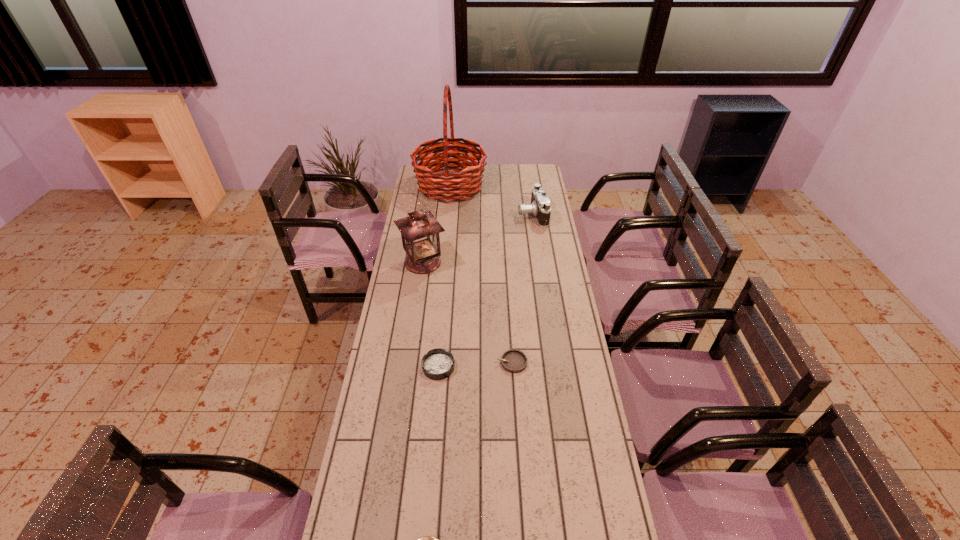
In order to click on vacant space located at the lens of the fourth shortest object in this screenshot , I will do `click(498, 214)`.

At what (x,y) coordinates should I click in order to perform the action: click on blank space located on the front of the rightmost ashtray. Please return your answer as a coordinate pair (x, y). Looking at the image, I should click on (520, 485).

Locate an element on the screen. The width and height of the screenshot is (960, 540). object located in the far edge section of the desktop is located at coordinates (439, 184).

Identify the location of basket present at the left edge. (439, 184).

At what (x,y) coordinates should I click in order to perform the action: click on oil lamp situated at the left edge. Please return your answer as a coordinate pair (x, y). Image resolution: width=960 pixels, height=540 pixels. Looking at the image, I should click on (420, 230).

Locate an element on the screen. The height and width of the screenshot is (540, 960). object present at the right edge is located at coordinates (540, 204).

Image resolution: width=960 pixels, height=540 pixels. Identify the location of object located at the far left corner. (439, 184).

This screenshot has height=540, width=960. I want to click on vacant region at the far edge of the desktop, so click(511, 172).

This screenshot has height=540, width=960. Identify the location of free space at the left edge of the desktop. (409, 321).

Locate an element on the screen. vacant space at the right edge of the desktop is located at coordinates (562, 337).